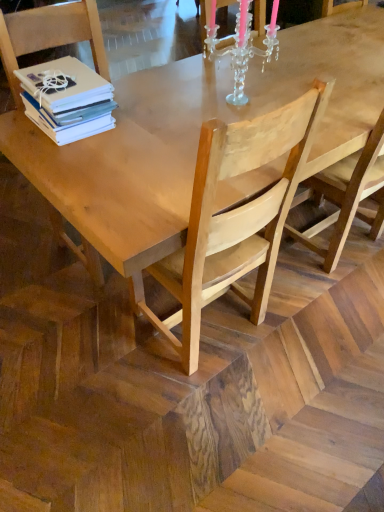
Identify the location of spots to the right of light brown wooden chair at center, the 1th chair positioned from the right. (309, 333).